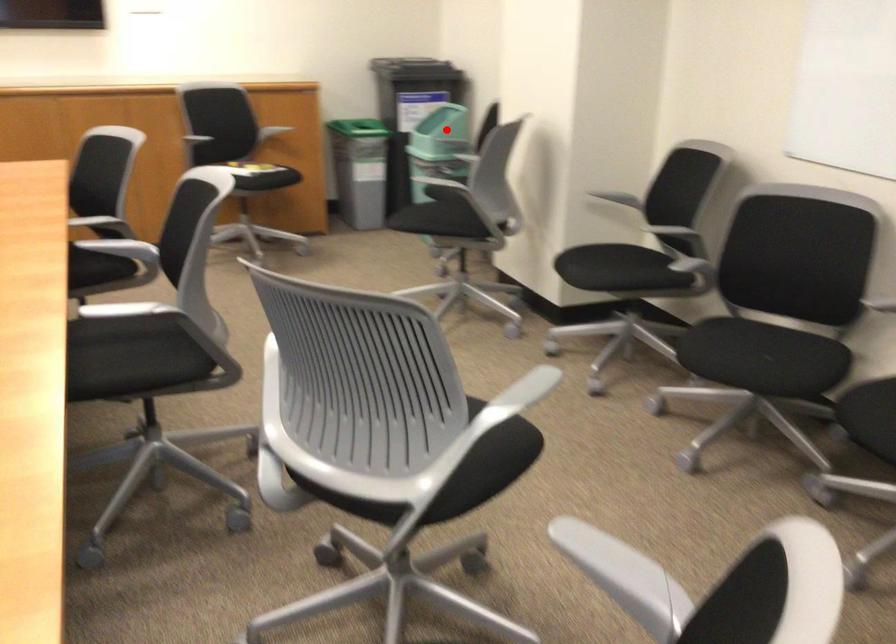
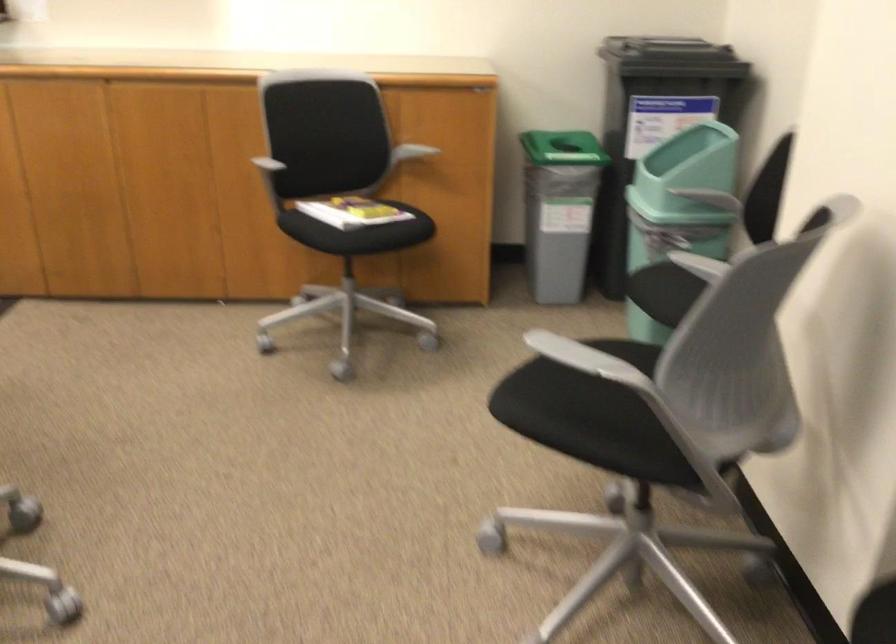
Locate, in the second image, the point that corresponds to the highlighted location in the first image.

(678, 207)